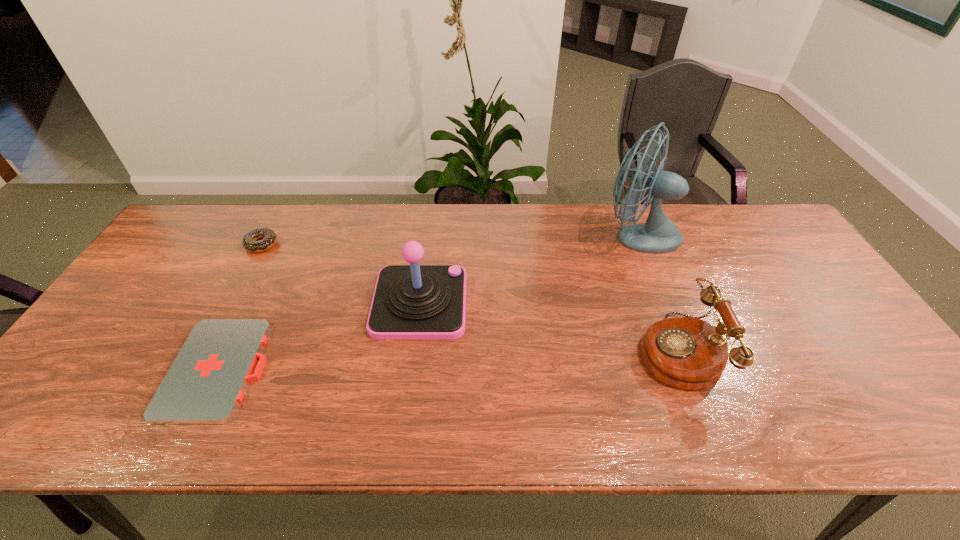
Image resolution: width=960 pixels, height=540 pixels. Identify the location of vacant space located 0.080m on the dial of the telephone. (606, 350).

Identify the location of free space located on the dial of the telephone. (578, 350).

Identify the location of vacant region located on the dial of the telephone. (485, 350).

Where is `vacant space located 0.120m on the right of the second shortest object`? The image size is (960, 540). vacant space located 0.120m on the right of the second shortest object is located at coordinates (316, 245).

Find the location of a particular element. This screenshot has height=540, width=960. blank area located on handle side the shortest object is located at coordinates (364, 369).

Image resolution: width=960 pixels, height=540 pixels. Find the location of `fan that is at the far edge`. fan that is at the far edge is located at coordinates (658, 234).

Locate an element on the screen. The image size is (960, 540). doughnut located in the far edge section of the desktop is located at coordinates (249, 241).

Identify the location of object present at the near edge. (205, 383).

In the image, there is a desktop. Where is `vacant region at the far edge`? This screenshot has width=960, height=540. vacant region at the far edge is located at coordinates (511, 222).

Image resolution: width=960 pixels, height=540 pixels. In order to click on vacant space at the near edge in this screenshot , I will do `click(276, 423)`.